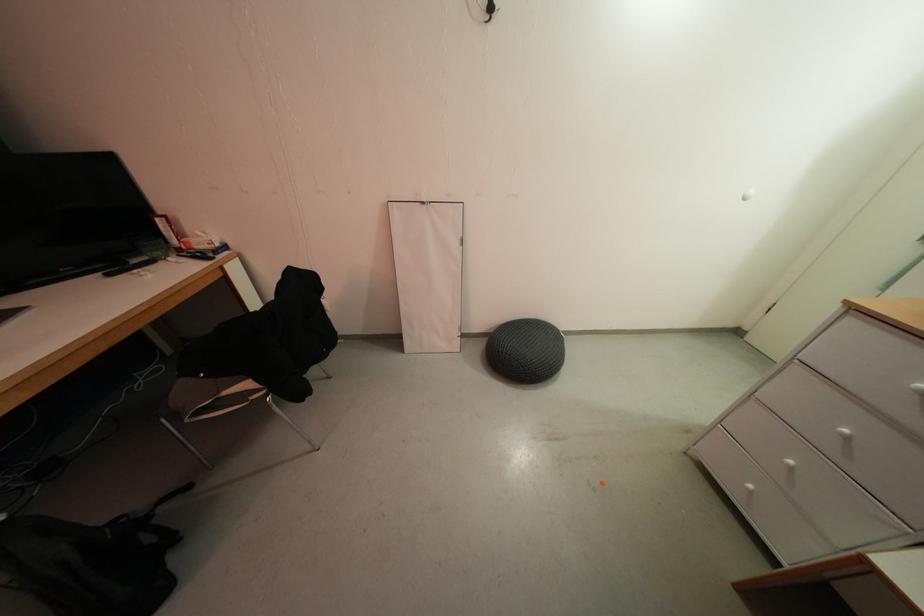
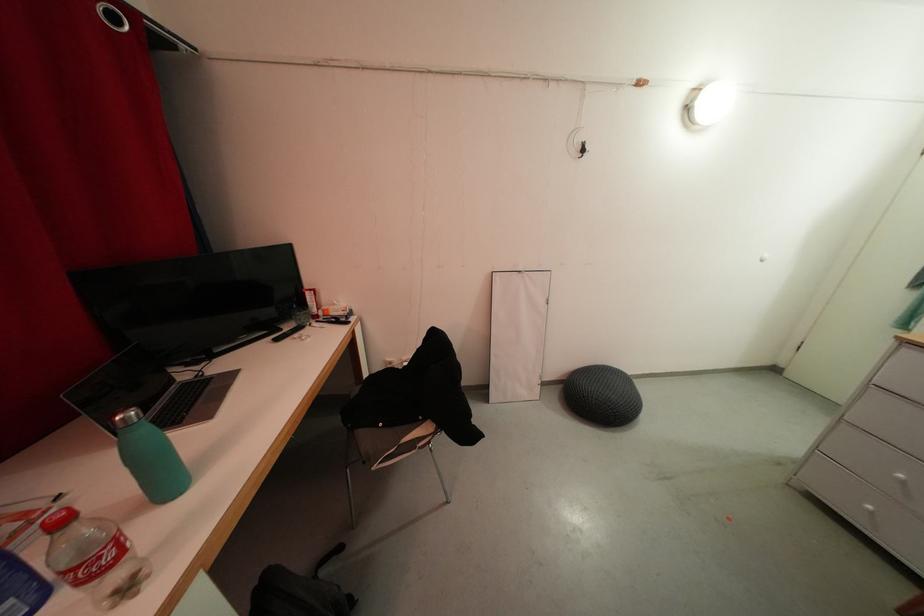
Find the pixel in the second image that matches point (308, 288) in the first image.

(441, 345)